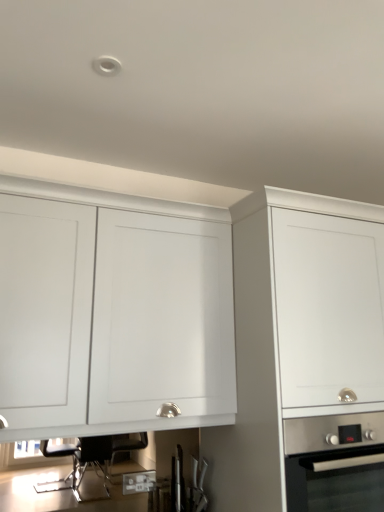
Question: Is white matte cabinet at center, positioned as the 2th cabinetry in left-to-right order, touching stainless steel oven at lower right?

Choices:
 (A) yes
 (B) no

Answer: (B)

Question: Is white matte cabinet at center, positioned as the 2th cabinetry in left-to-right order, behind stainless steel oven at lower right?

Choices:
 (A) yes
 (B) no

Answer: (B)

Question: Is white matte cabinet at center, which ranks as the 1th cabinetry in right-to-left order, smaller than stainless steel oven at lower right?

Choices:
 (A) yes
 (B) no

Answer: (B)

Question: Is stainless steel oven at lower right inside white matte cabinet at center, positioned as the 2th cabinetry in left-to-right order?

Choices:
 (A) no
 (B) yes

Answer: (B)

Question: Is white matte cabinet at center, positioned as the 2th cabinetry in left-to-right order, bigger than stainless steel oven at lower right?

Choices:
 (A) yes
 (B) no

Answer: (A)

Question: Is white matte cabinet at center, positioned as the 2th cabinetry in left-to-right order, situated inside stainless steel oven at lower right or outside?

Choices:
 (A) inside
 (B) outside

Answer: (B)

Question: In the image, is white matte cabinet at center, which ranks as the 1th cabinetry in right-to-left order, on the left side or the right side of stainless steel oven at lower right?

Choices:
 (A) right
 (B) left

Answer: (A)

Question: Considering the positions of point click(230, 444) and point click(304, 445), is point click(230, 444) closer or farther from the camera than point click(304, 445)?

Choices:
 (A) closer
 (B) farther

Answer: (B)

Question: Looking at their shapes, would you say white matte cabinet at center, which ranks as the 1th cabinetry in right-to-left order, is wider or thinner than stainless steel oven at lower right?

Choices:
 (A) wide
 (B) thin

Answer: (A)

Question: From their relative heights in the image, would you say white matte cabinet at center, positioned as the 2th cabinetry in left-to-right order, is taller or shorter than white matte cabinet at upper left, which ranks as the 2th cabinetry in right-to-left order?

Choices:
 (A) tall
 (B) short

Answer: (A)

Question: Is white matte cabinet at center, which ranks as the 1th cabinetry in right-to-left order, wider or thinner than white matte cabinet at upper left, the first cabinetry viewed from the left?

Choices:
 (A) wide
 (B) thin

Answer: (A)

Question: Relative to white matte cabinet at upper left, the first cabinetry viewed from the left, is white matte cabinet at center, positioned as the 2th cabinetry in left-to-right order, in front or behind?

Choices:
 (A) front
 (B) behind

Answer: (A)

Question: Would you say white matte cabinet at center, positioned as the 2th cabinetry in left-to-right order, is to the left or to the right of white matte cabinet at upper left, which ranks as the 2th cabinetry in right-to-left order, in the picture?

Choices:
 (A) left
 (B) right

Answer: (B)

Question: Is point (54, 403) positioned closer to the camera than point (271, 381)?

Choices:
 (A) farther
 (B) closer

Answer: (B)

Question: Is white matte cabinet at upper left, the first cabinetry viewed from the left, inside or outside of white matte cabinet at center, positioned as the 2th cabinetry in left-to-right order?

Choices:
 (A) inside
 (B) outside

Answer: (B)